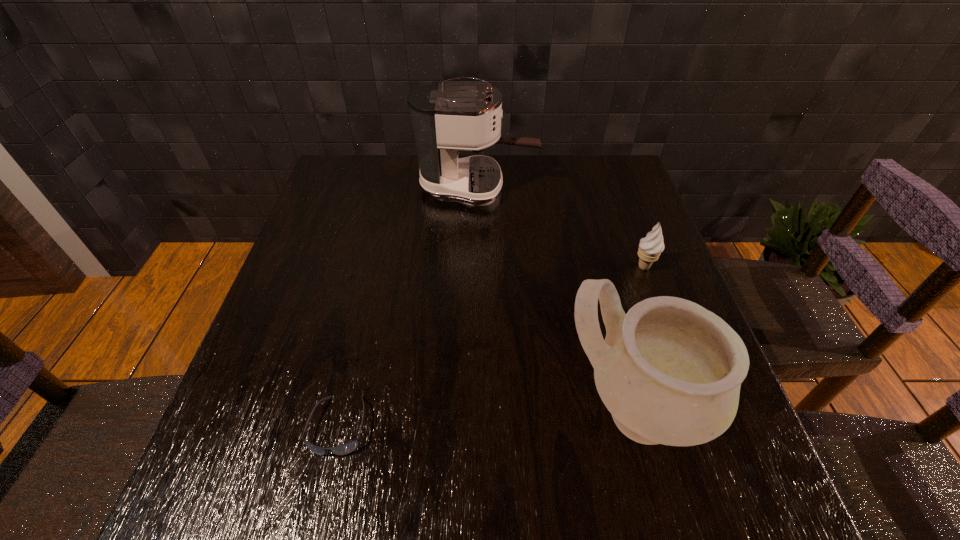
This screenshot has height=540, width=960. Identify the location of free space that satisfies the following two spatial constraints: 1. on the front-facing side of the pottery; 2. on the left side of the farthest object. (475, 412).